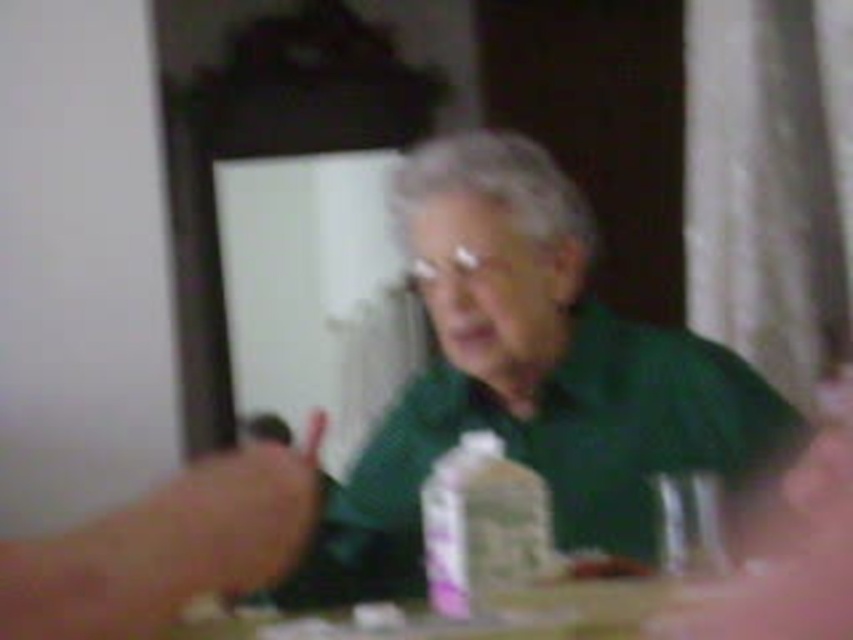
Question: Among these objects, which one is nearest to the camera?

Choices:
 (A) wooden table at center
 (B) green matte shirt at center

Answer: (A)

Question: Does green matte shirt at center come in front of wooden table at center?

Choices:
 (A) no
 (B) yes

Answer: (A)

Question: Is green matte shirt at center above wooden table at center?

Choices:
 (A) no
 (B) yes

Answer: (B)

Question: Does green matte shirt at center have a larger size compared to wooden table at center?

Choices:
 (A) no
 (B) yes

Answer: (B)